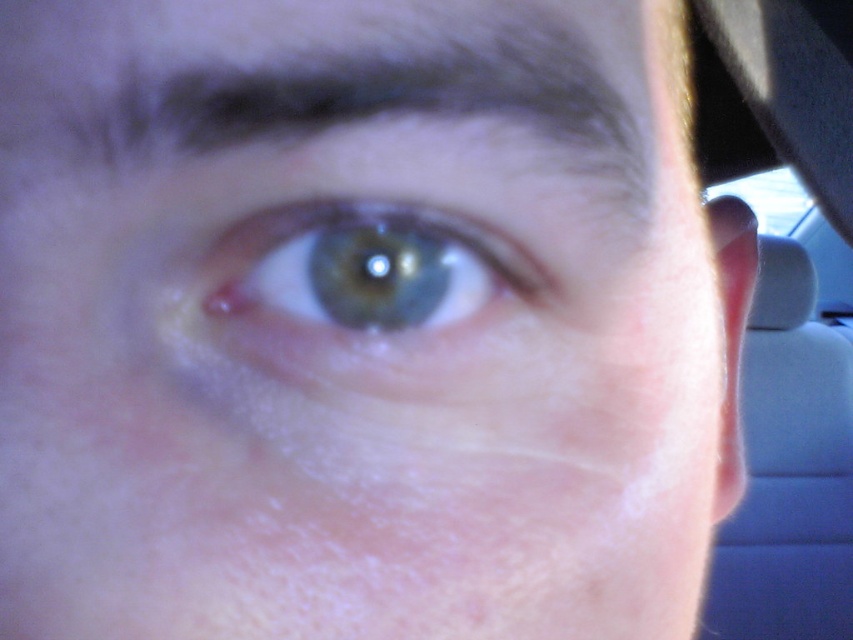
Question: Which object appears farthest from the camera in this image?

Choices:
 (A) green matte eye at center
 (B) dark brown hair at upper center

Answer: (A)

Question: Does dark brown hair at upper center have a smaller size compared to green matte eye at center?

Choices:
 (A) no
 (B) yes

Answer: (A)

Question: Is dark brown hair at upper center further to camera compared to green matte eye at center?

Choices:
 (A) yes
 (B) no

Answer: (B)

Question: Can you confirm if dark brown hair at upper center is thinner than green matte eye at center?

Choices:
 (A) no
 (B) yes

Answer: (A)

Question: Which object appears closest to the camera in this image?

Choices:
 (A) green matte eye at center
 (B) dark brown hair at upper center

Answer: (B)

Question: Which point is closer to the camera?

Choices:
 (A) (189, 125)
 (B) (292, 362)

Answer: (A)